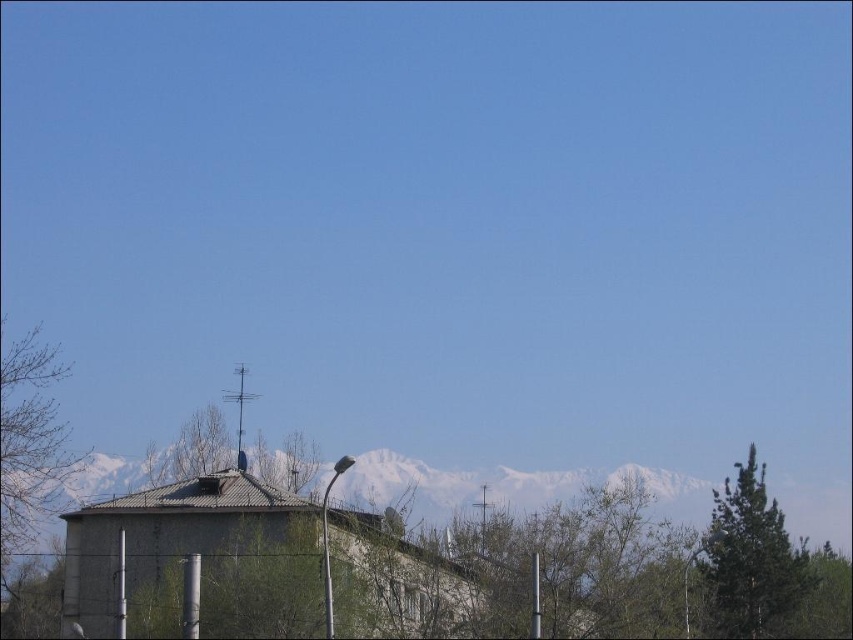
Is point (715, 608) closer to viewer compared to point (51, 460)?

Yes, point (715, 608) is closer to viewer.

Image resolution: width=853 pixels, height=640 pixels. Describe the element at coordinates (751, 557) in the screenshot. I see `green textured tree at right` at that location.

Where is `green textured tree at right`? The height and width of the screenshot is (640, 853). green textured tree at right is located at coordinates (751, 557).